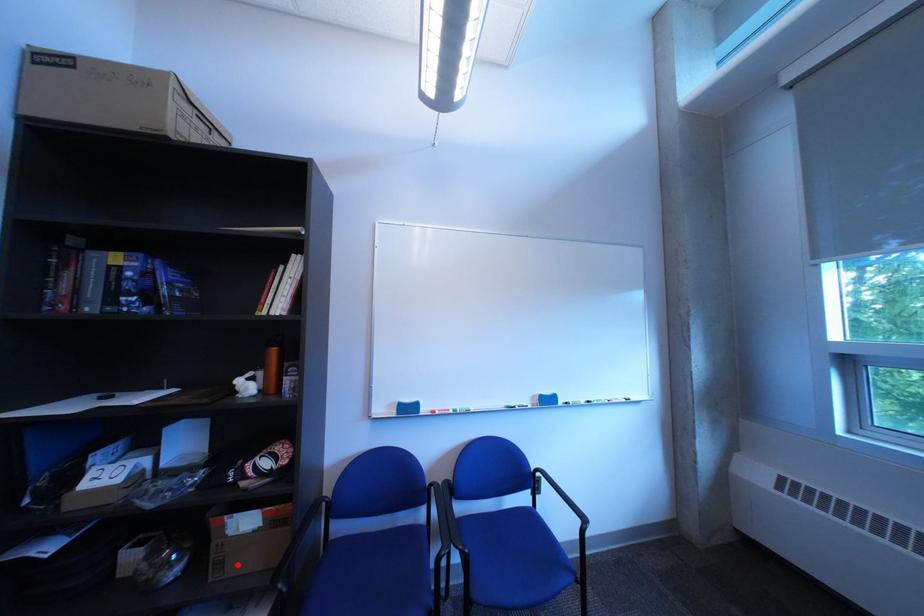
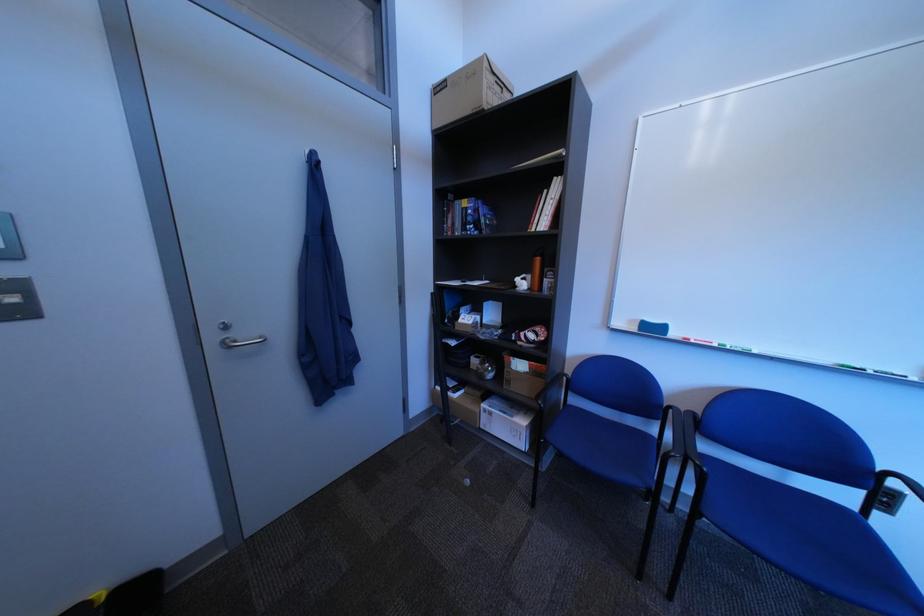
Question: I am providing you with two images of the same scene from different viewpoints. A red point is shown in image1. For the corresponding object point in image2, is it positioned nearer or farther from the camera?

Choices:
 (A) Nearer
 (B) Farther

Answer: (B)